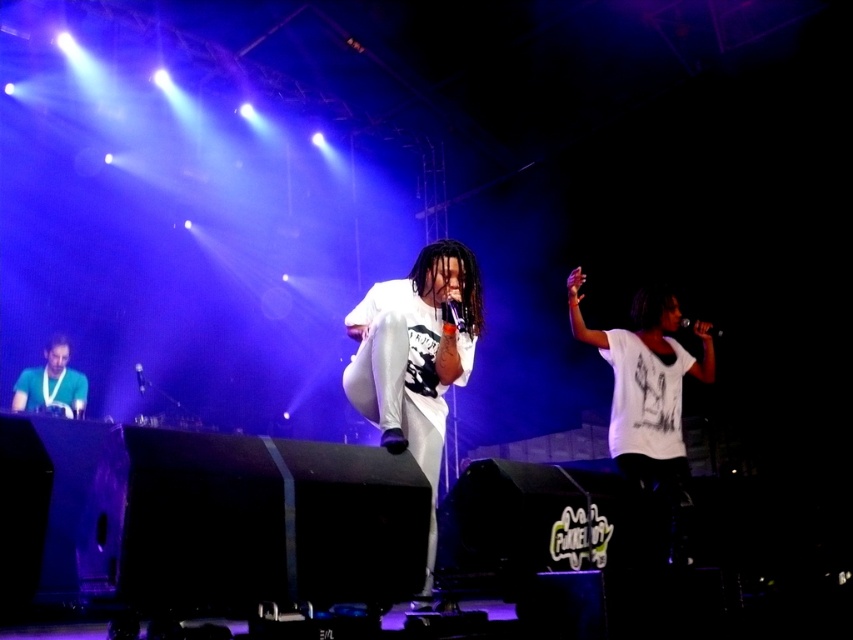
You are a stagehand who needs to place a new spotlight on the stage. The spotlight can only illuminate a specific area defined by coordinates between x 0.5 and x 0.6, and y 0.05 and y 0.07. Will the green matte shirt at lower left be within this illuminated area?

The green matte shirt at lower left is located at point (51, 381). Since the x coordinate 0.598 falls between 0.5 and 0.6, and the y coordinate 0.061 falls between 0.05 and 0.07, the green matte shirt at lower left will be within the illuminated area.